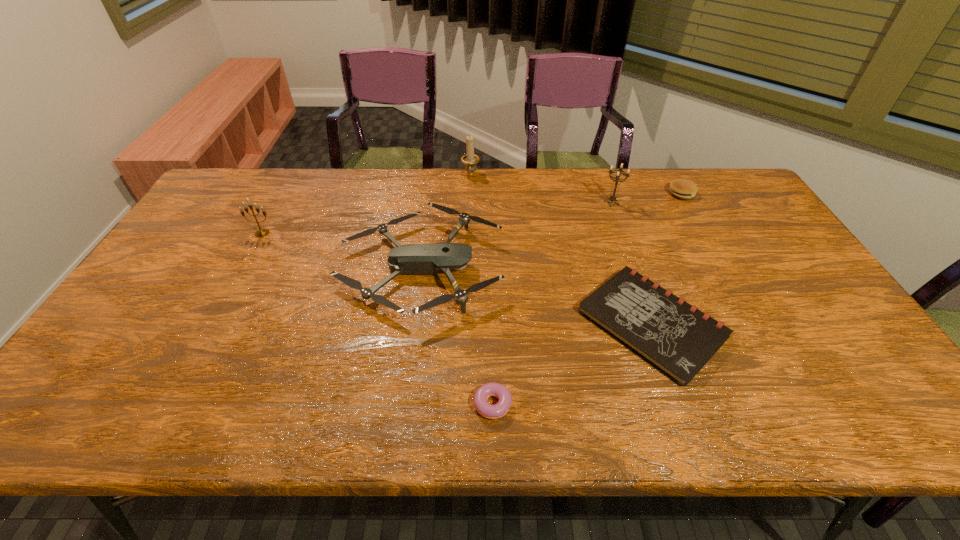
Find the location of a particular element. empty space between the fourth tallest object and the fifth tallest object is located at coordinates (551, 231).

Where is `unoccupied position between the fourth shortest object and the notebook`? The image size is (960, 540). unoccupied position between the fourth shortest object and the notebook is located at coordinates (536, 295).

You are a GUI agent. You are given a task and a screenshot of the screen. Output one action in this format:
    pyautogui.click(x=<x>, y=<y>)
    Task: Click on the free space between the farthest candelabrum and the third shortest object
    The width and height of the screenshot is (960, 540).
    Given the screenshot: What is the action you would take?
    pyautogui.click(x=576, y=184)

This screenshot has height=540, width=960. I want to click on blank region between the second candelabrum from right to left and the third shortest object, so click(x=576, y=184).

Select which object appears as the third closest to the second candelabrum from left to right. Please provide its 2D coordinates. Your answer should be formatted as a tuple, i.e. [(x, y)], where the tuple contains the x and y coordinates of a point satisfying the conditions above.

[(678, 339)]

Identify which object is located as the third nearest to the nearest object. Please provide its 2D coordinates. Your answer should be formatted as a tuple, i.e. [(x, y)], where the tuple contains the x and y coordinates of a point satisfying the conditions above.

[(612, 198)]

Locate an element on the screen. the second closest candelabrum to the nearest object is located at coordinates (264, 232).

Identify which candelabrum is located as the third nearest to the notebook. Please provide its 2D coordinates. Your answer should be formatted as a tuple, i.e. [(x, y)], where the tuple contains the x and y coordinates of a point satisfying the conditions above.

[(264, 232)]

Locate an element on the screen. free space that satisfies the following two spatial constraints: 1. with a camera mounted on the front of the drone; 2. on the right side of the nearest object is located at coordinates click(402, 404).

Locate an element on the screen. Image resolution: width=960 pixels, height=540 pixels. vacant region that satisfies the following two spatial constraints: 1. on the handle side of the farthest object; 2. on the left side of the rightmost candelabrum is located at coordinates (469, 203).